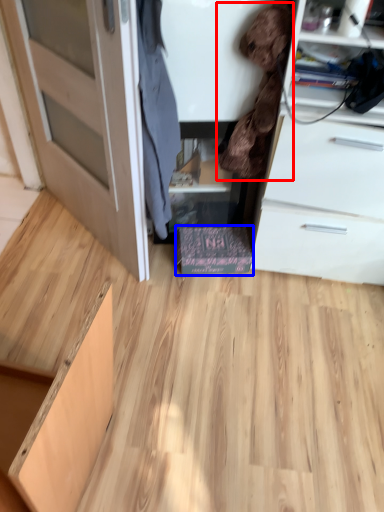
Question: Which point is further to the camera, clothing (highlighted by a red box) or cabinetry (highlighted by a blue box)?

Choices:
 (A) clothing
 (B) cabinetry

Answer: (B)